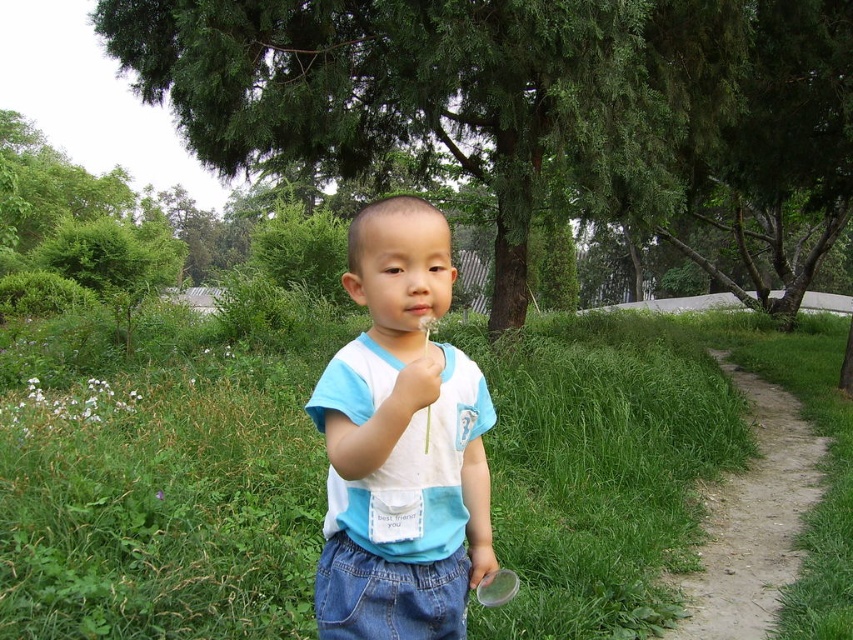
Is green grass at center taller than white matte hand at center?

Yes, green grass at center is taller than white matte hand at center.

Which is below, green grass at center or white matte hand at center?

green grass at center

Image resolution: width=853 pixels, height=640 pixels. What do you see at coordinates (643, 465) in the screenshot?
I see `green grass at center` at bounding box center [643, 465].

Find the location of a particular element. The width and height of the screenshot is (853, 640). green grass at center is located at coordinates (643, 465).

Does point (447, 481) come farther from viewer compared to point (753, 552)?

No, (447, 481) is in front of (753, 552).

Between blue cotton shirt at center and dirt path at right, which one appears on the left side from the viewer's perspective?

blue cotton shirt at center is more to the left.

Between point (375, 474) and point (735, 534), which one is positioned in front?

Point (375, 474) is more forward.

This screenshot has width=853, height=640. I want to click on blue cotton shirt at center, so click(x=399, y=445).

Which is in front, point (457, 428) or point (399, 419)?

Point (399, 419)

Which is more to the right, blue cotton shirt at center or white matte hand at center?

Positioned to the right is white matte hand at center.

What do you see at coordinates (399, 445) in the screenshot?
I see `blue cotton shirt at center` at bounding box center [399, 445].

Locate an element on the screen. This screenshot has height=640, width=853. blue cotton shirt at center is located at coordinates (399, 445).